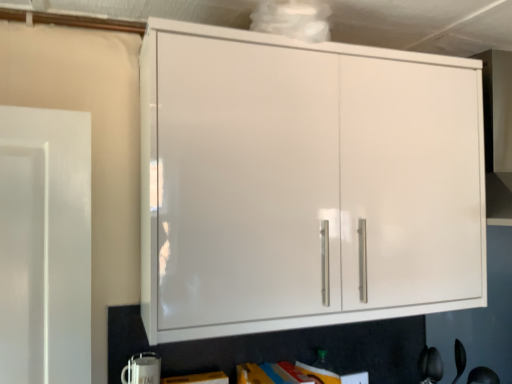
The height and width of the screenshot is (384, 512). What do you see at coordinates (142, 369) in the screenshot? I see `white glossy mug at lower left` at bounding box center [142, 369].

From the picture: What is the approximate height of white glossy mug at lower left?

It is 3.19 inches.

You are a GUI agent. You are given a task and a screenshot of the screen. Output one action in this format:
    pyautogui.click(x=<x>, y=<y>)
    Task: Click on the white glossy mug at lower left
    The image size is (512, 384).
    Given the screenshot: What is the action you would take?
    pyautogui.click(x=142, y=369)

I want to click on white glossy cabinet at upper center, so click(x=306, y=182).

Describe the element at coordinates (306, 182) in the screenshot. I see `white glossy cabinet at upper center` at that location.

Identify the location of white glossy mug at lower left. (142, 369).

Can you confirm if white glossy cabinet at upper center is positioned to the right of white glossy mug at lower left?

Correct, you'll find white glossy cabinet at upper center to the right of white glossy mug at lower left.

Which object is closer to the camera taking this photo, white glossy cabinet at upper center or white glossy mug at lower left?

white glossy cabinet at upper center is closer to the camera.

Which is nearer, (270, 121) or (128, 377)?

Positioned in front is point (270, 121).

From the image's perspective, is white glossy cabinet at upper center located beneath white glossy mug at lower left?

No.

From a real-world perspective, between white glossy cabinet at upper center and white glossy mug at lower left, who is vertically higher?

white glossy cabinet at upper center, from a real-world perspective.

Does white glossy cabinet at upper center have a greater width compared to white glossy mug at lower left?

Yes, white glossy cabinet at upper center is wider than white glossy mug at lower left.

Is white glossy cabinet at upper center taller than white glossy mug at lower left?

Yes, white glossy cabinet at upper center is taller than white glossy mug at lower left.

Which of these two, white glossy cabinet at upper center or white glossy mug at lower left, is smaller?

Smaller between the two is white glossy mug at lower left.

Can white glossy mug at lower left be found inside white glossy cabinet at upper center?

Actually, white glossy mug at lower left is outside white glossy cabinet at upper center.

From the picture: Are white glossy cabinet at upper center and white glossy mug at lower left located far from each other?

No.

Is white glossy cabinet at upper center turned away from white glossy mug at lower left?

That's not correct — white glossy cabinet at upper center is not looking away from white glossy mug at lower left.

How many degrees apart are the facing directions of white glossy cabinet at upper center and white glossy mug at lower left?

The facing directions of white glossy cabinet at upper center and white glossy mug at lower left are 0.000592 degrees apart.

Find the location of a particular element. Image resolution: width=512 pixels, height=384 pixels. cupboard that appears above the white glossy mug at lower left (from a real-world perspective) is located at coordinates coord(306,182).

Which is more to the right, white glossy mug at lower left or white glossy cabinet at upper center?

white glossy cabinet at upper center is more to the right.

Between white glossy mug at lower left and white glossy cabinet at upper center, which one is positioned in front?

Positioned in front is white glossy cabinet at upper center.

Is point (151, 380) positioned after point (275, 182)?

Yes, point (151, 380) is behind point (275, 182).

From the image's perspective, is white glossy mug at lower left above or below white glossy cabinet at upper center?

white glossy mug at lower left is below white glossy cabinet at upper center.

From the picture: From a real-world perspective, which is physically below, white glossy mug at lower left or white glossy cabinet at upper center?

white glossy mug at lower left, from a real-world perspective.

Between white glossy mug at lower left and white glossy cabinet at upper center, which one has smaller width?

Thinner between the two is white glossy mug at lower left.

In the scene shown: Considering the relative sizes of white glossy mug at lower left and white glossy cabinet at upper center in the image provided, is white glossy mug at lower left taller than white glossy cabinet at upper center?

Incorrect, the height of white glossy mug at lower left is not larger of that of white glossy cabinet at upper center.

Can you confirm if white glossy mug at lower left is bigger than white glossy cabinet at upper center?

Incorrect, white glossy mug at lower left is not larger than white glossy cabinet at upper center.

Is white glossy mug at lower left outside of white glossy cabinet at upper center?

white glossy mug at lower left is positioned outside white glossy cabinet at upper center.

Would you say white glossy mug at lower left is a long distance from white glossy cabinet at upper center?

No, white glossy mug at lower left is in close proximity to white glossy cabinet at upper center.

Is white glossy mug at lower left positioned with its back to white glossy cabinet at upper center?

white glossy mug at lower left does not have its back to white glossy cabinet at upper center.

Can you tell me how much white glossy mug at lower left and white glossy cabinet at upper center differ in facing direction?

The angular difference between white glossy mug at lower left and white glossy cabinet at upper center is 0.000592 degrees.

How much distance is there between white glossy mug at lower left and white glossy cabinet at upper center?

white glossy mug at lower left is 29.71 inches away from white glossy cabinet at upper center.

Find the location of a particular element. appliance lying below the white glossy cabinet at upper center (from the image's perspective) is located at coordinates (142, 369).

The height and width of the screenshot is (384, 512). Identify the location of cupboard lying on the right of white glossy mug at lower left. (306, 182).

Locate an element on the screen. appliance below the white glossy cabinet at upper center (from a real-world perspective) is located at coordinates (142, 369).